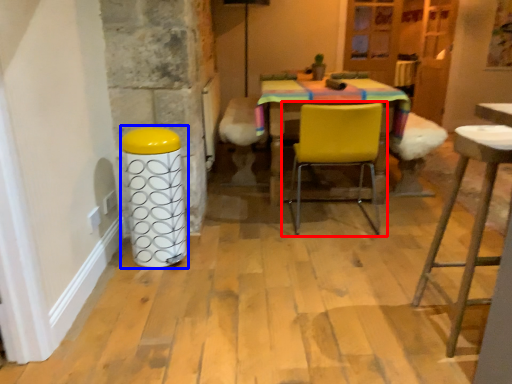
Question: Among these objects, which one is farthest to the camera, chair (highlighted by a red box) or bar stool (highlighted by a blue box)?

Choices:
 (A) chair
 (B) bar stool

Answer: (A)